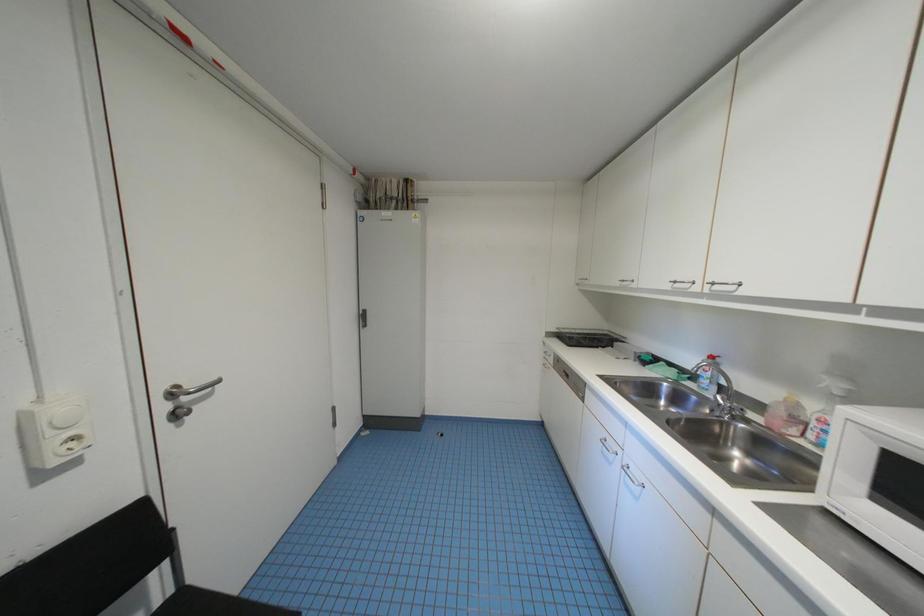
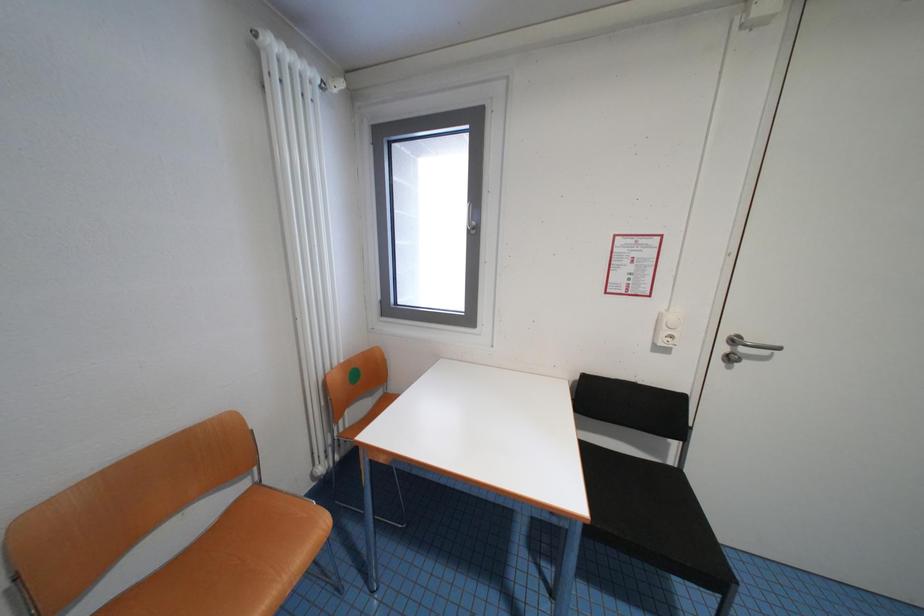
Question: The first image is from the beginning of the video and the second image is from the end. How did the camera likely rotate when shooting the video?

Choices:
 (A) Left
 (B) Right
 (C) Up
 (D) Down

Answer: (A)